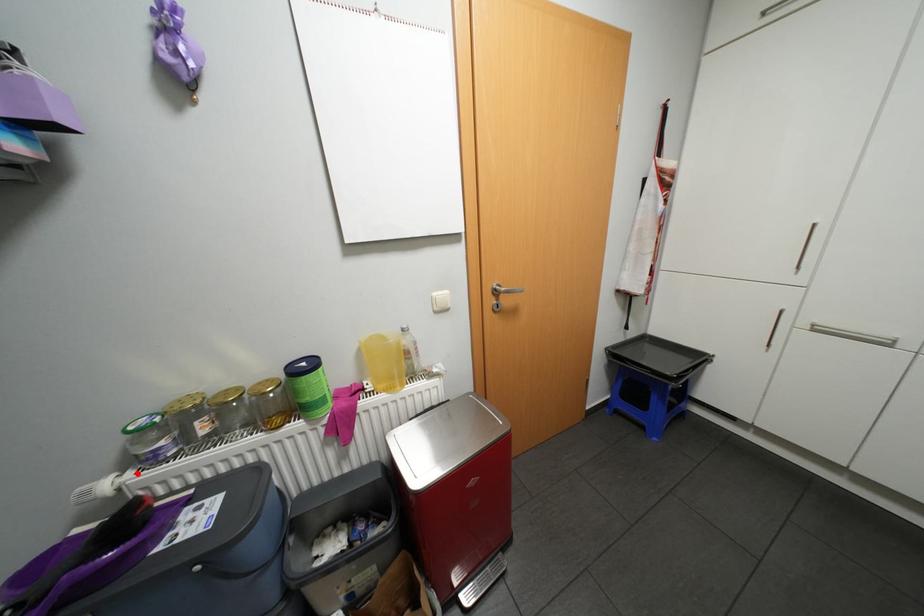
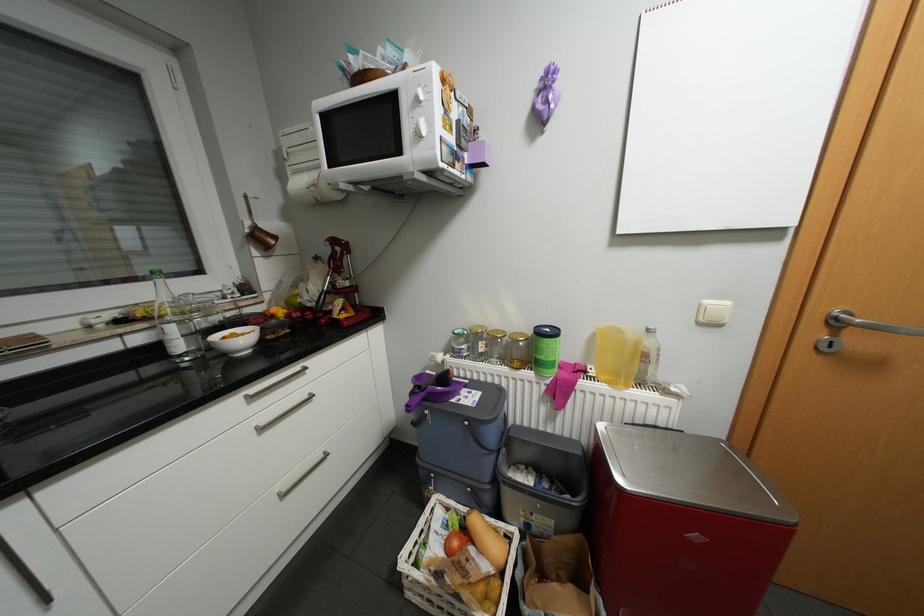
The point at the highlighted location is marked in the first image. Where is the corresponding point in the second image?

(456, 355)